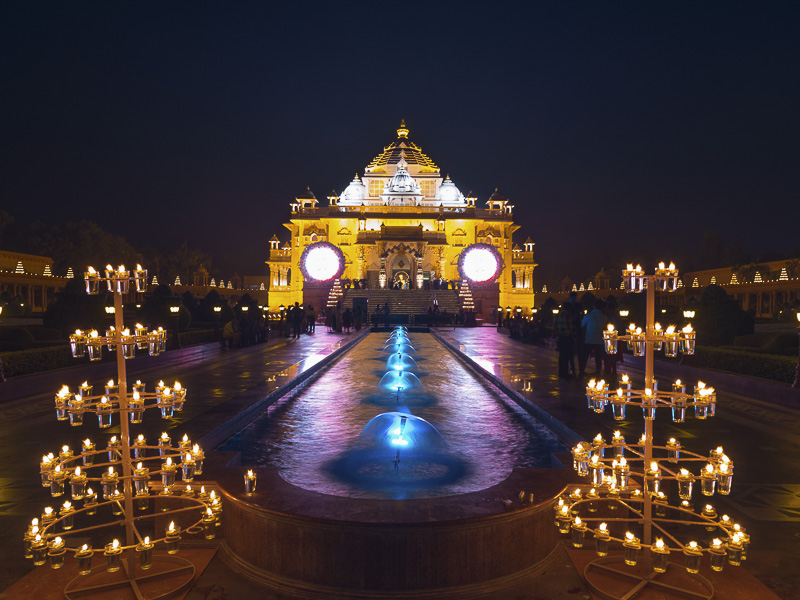
Locate an element on the screen. The width and height of the screenshot is (800, 600). light is located at coordinates (318, 260), (480, 270), (401, 180), (456, 190), (354, 183).